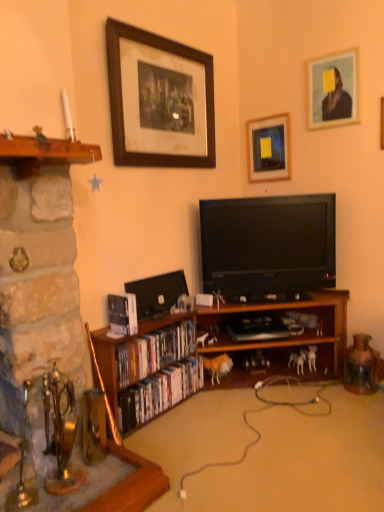
What are the coordinates of `vacant space to the right of hardcover book at lower left, the 3th book ordered from the bottom` in the screenshot? It's located at (142, 330).